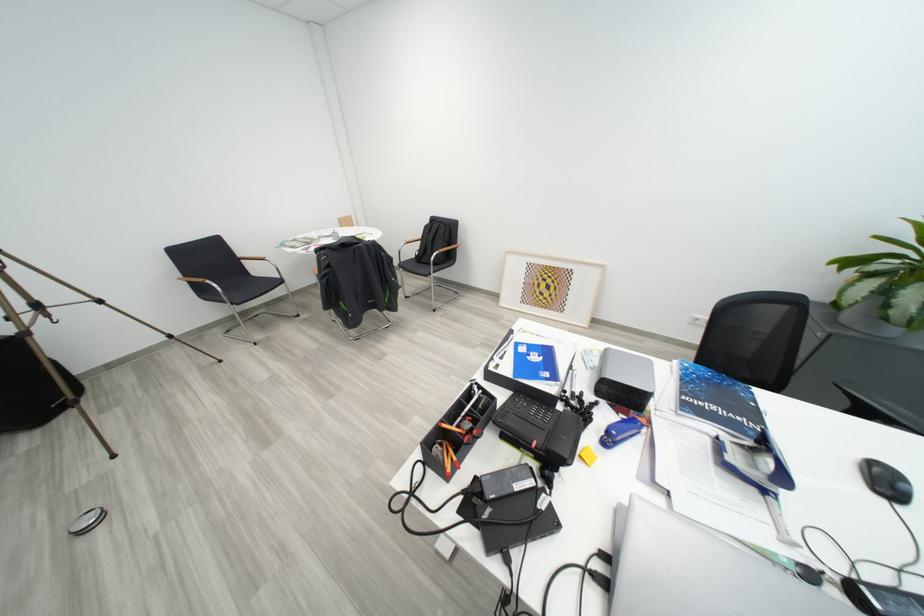
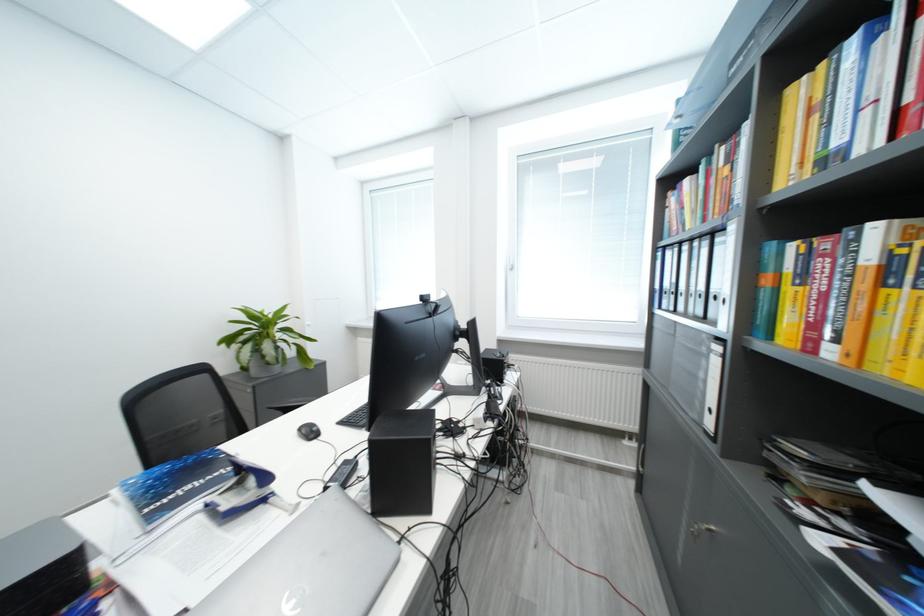
Locate, in the second image, the point that corresponds to point (895, 485) in the first image.

(319, 435)